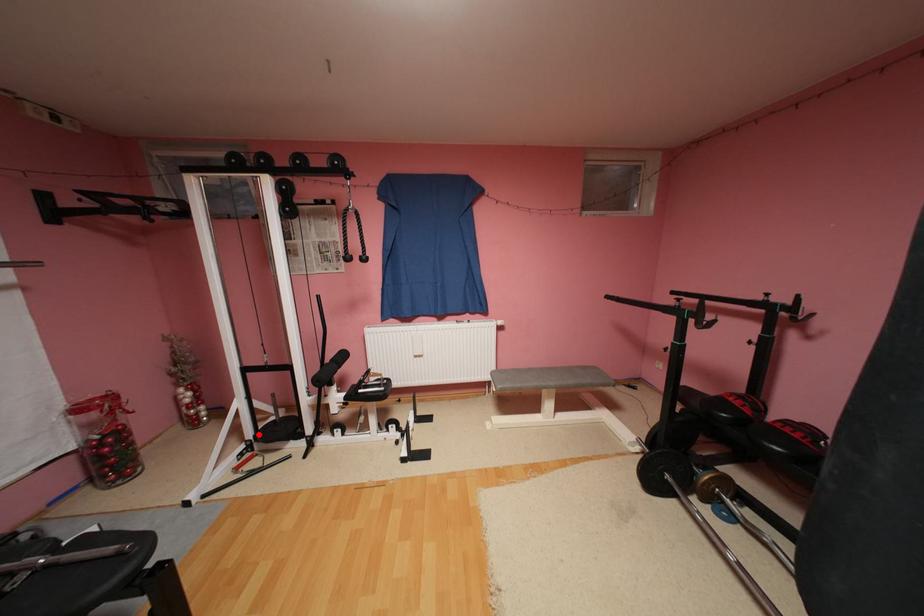
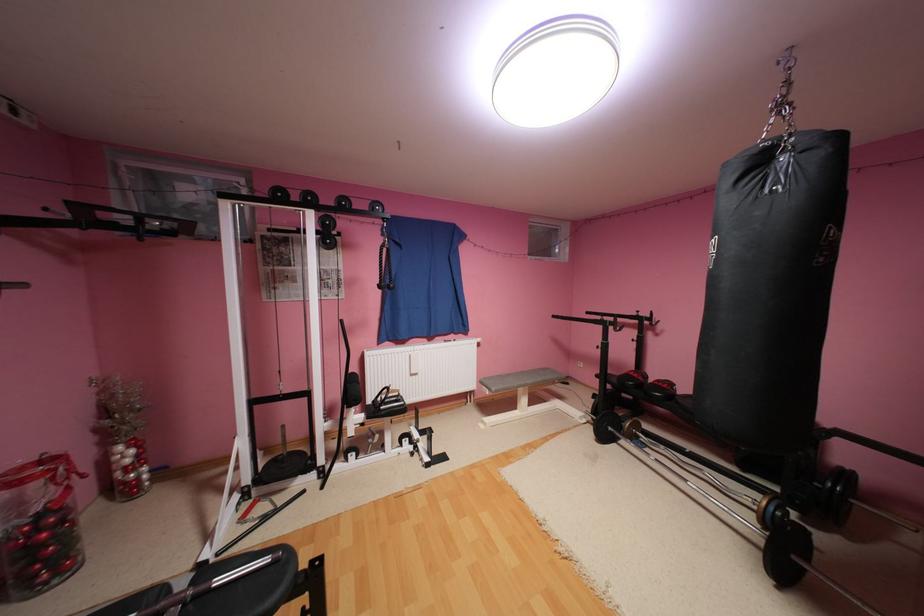
Where in the second image is the point corresponding to the highlighted location from the first image?

(256, 479)